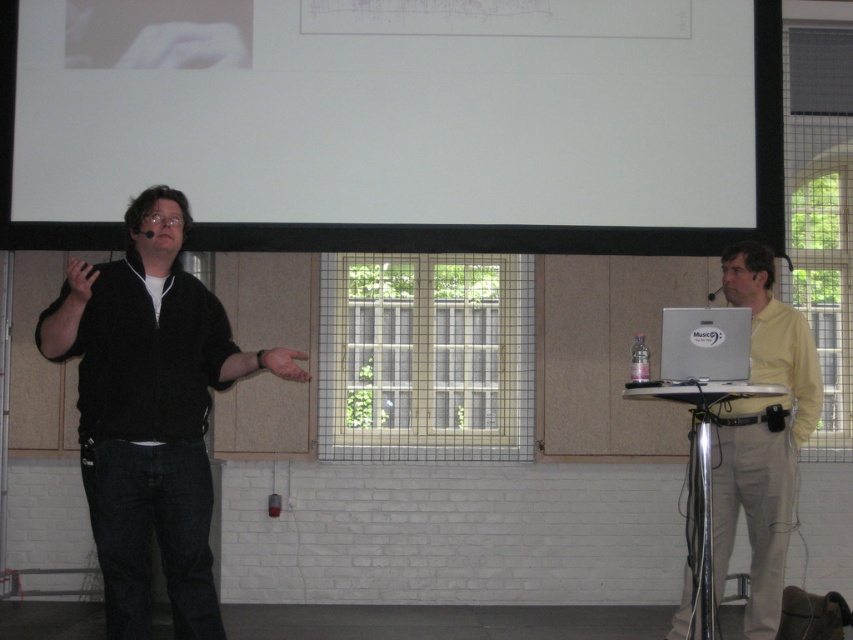
Question: In this image, where is white matte projection screen at upper center located relative to silver metallic computer at right?

Choices:
 (A) below
 (B) above

Answer: (B)

Question: Which object appears farthest from the camera in this image?

Choices:
 (A) matte skin hand at center
 (B) silver metallic computer at right
 (C) black matte jacket at left

Answer: (B)

Question: Which object appears farthest from the camera in this image?

Choices:
 (A) white matte projection screen at upper center
 (B) black matte jacket at left

Answer: (A)

Question: Which of the following is the closest to the observer?

Choices:
 (A) (270, 371)
 (B) (764, 372)
 (C) (677, 356)

Answer: (C)

Question: Is yellow smooth shirt at right positioned in front of matte skin hand at center?

Choices:
 (A) yes
 (B) no

Answer: (B)

Question: Can you confirm if yellow smooth shirt at right is positioned to the left of matte skin hand at center?

Choices:
 (A) no
 (B) yes

Answer: (A)